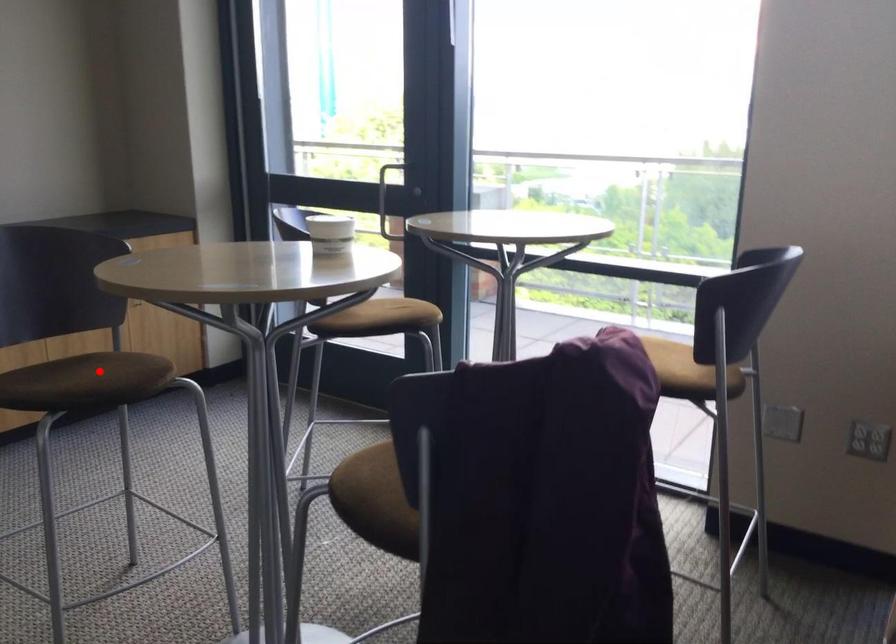
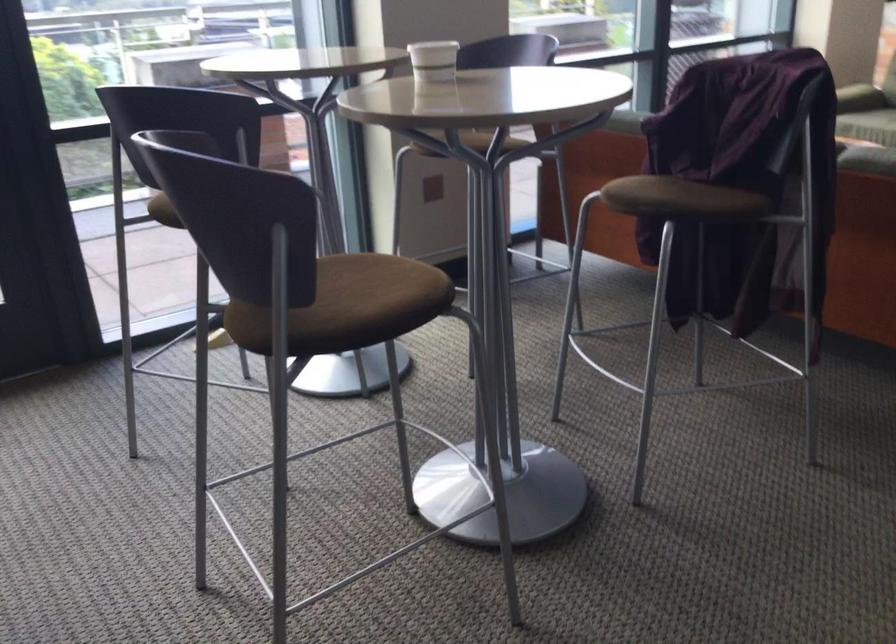
Question: I am providing you with two images of the same scene from different viewpoints. In image1, a red point is highlighted. Considering the same 3D point in image2, which of the following is correct?

Choices:
 (A) It is closer
 (B) It is farther

Answer: (A)